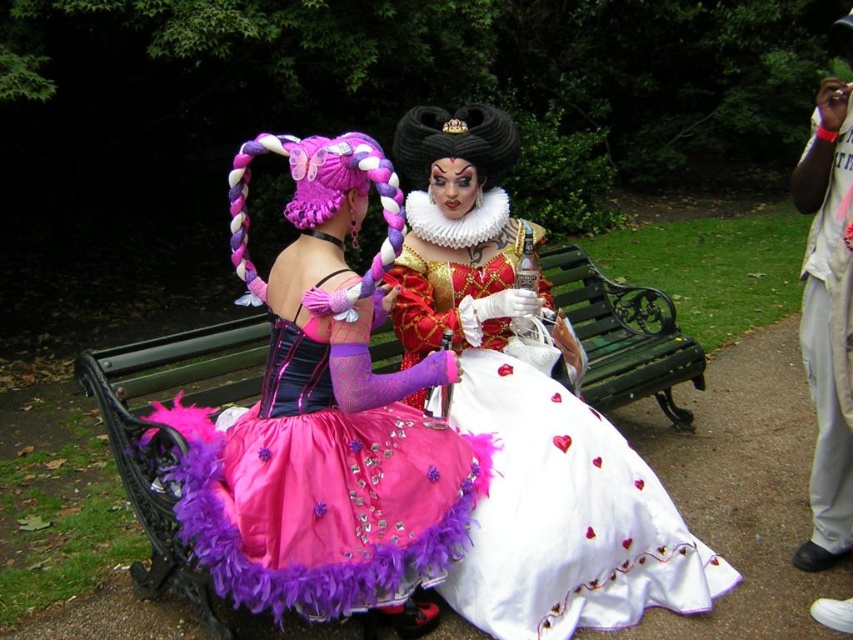
How far apart are white satin dress at center and green wooden bench at center?

The distance of white satin dress at center from green wooden bench at center is 28.48 inches.

Where is `white satin dress at center`? This screenshot has height=640, width=853. white satin dress at center is located at coordinates (566, 516).

You are a GUI agent. You are given a task and a screenshot of the screen. Output one action in this format:
    pyautogui.click(x=<x>, y=<y>)
    Task: Click on the white satin dress at center
    This screenshot has width=853, height=640.
    Given the screenshot: What is the action you would take?
    pyautogui.click(x=566, y=516)

Does point (347, 467) come in front of point (546, 252)?

Yes, point (347, 467) is closer to viewer.

Who is positioned more to the right, purple feathered dress at center or green wooden bench at center?

green wooden bench at center is more to the right.

Who is more distant from viewer, (250, 468) or (648, 368)?

Point (648, 368)

You are a GUI agent. You are given a task and a screenshot of the screen. Output one action in this format:
    pyautogui.click(x=<x>, y=<y>)
    Task: Click on the purple feathered dress at center
    This screenshot has width=853, height=640.
    Given the screenshot: What is the action you would take?
    pyautogui.click(x=328, y=420)

Between purple feathered dress at center and white satin dress at center, which one has less height?

white satin dress at center is shorter.

Between point (447, 461) and point (604, 502), which one is positioned behind?

The point (604, 502) is behind.

Find the location of a particular element. The height and width of the screenshot is (640, 853). purple feathered dress at center is located at coordinates (328, 420).